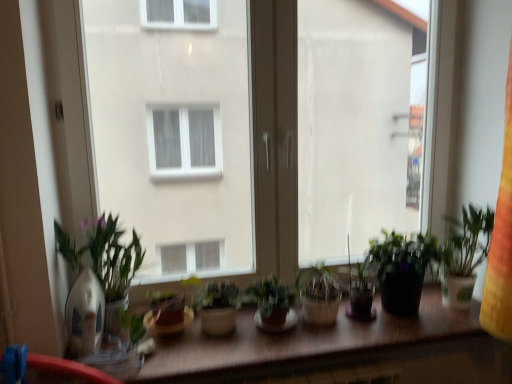
Question: Which direction should I rotate to face white matte window screen at center, arranged as the 2th window screen when viewed from the right, — up or down?

Choices:
 (A) up
 (B) down

Answer: (A)

Question: Considering the relative positions of green matte plant at center, positioned as the 2th houseplant in left-to-right order, and matte brown pot at center, which is the 1th houseplant from left to right, in the image provided, is green matte plant at center, positioned as the 2th houseplant in left-to-right order, to the left of matte brown pot at center, which is the 1th houseplant from left to right, from the viewer's perspective?

Choices:
 (A) no
 (B) yes

Answer: (A)

Question: Considering the relative sizes of green matte plant at center, positioned as the 2th houseplant in left-to-right order, and matte brown pot at center, which is the 1th houseplant from left to right, in the image provided, is green matte plant at center, positioned as the 2th houseplant in left-to-right order, wider than matte brown pot at center, which is the 1th houseplant from left to right,?

Choices:
 (A) no
 (B) yes

Answer: (A)

Question: Is green matte plant at center, which is counted as the third houseplant, starting from the right, oriented away from matte brown pot at center, which appears as the fourth houseplant when viewed from the right?

Choices:
 (A) yes
 (B) no

Answer: (B)

Question: Does green matte plant at center, which is counted as the third houseplant, starting from the right, turn towards matte brown pot at center, which appears as the fourth houseplant when viewed from the right?

Choices:
 (A) yes
 (B) no

Answer: (B)

Question: From the image's perspective, is green matte plant at center, positioned as the 2th houseplant in left-to-right order, over matte brown pot at center, which appears as the fourth houseplant when viewed from the right?

Choices:
 (A) no
 (B) yes

Answer: (B)

Question: Does green matte plant at center, positioned as the 2th houseplant in left-to-right order, lie in front of matte brown pot at center, which appears as the fourth houseplant when viewed from the right?

Choices:
 (A) no
 (B) yes

Answer: (A)

Question: Is matte brown pot at center, which is the 1th houseplant from left to right, wider than transparent plastic window screen at center, which is the 1th window screen in right-to-left order?

Choices:
 (A) yes
 (B) no

Answer: (A)

Question: Is matte brown pot at center, which is the 1th houseplant from left to right, shorter than transparent plastic window screen at center, acting as the 2th window screen starting from the left?

Choices:
 (A) no
 (B) yes

Answer: (B)

Question: Is matte brown pot at center, which appears as the fourth houseplant when viewed from the right, aimed at transparent plastic window screen at center, which is the 1th window screen in right-to-left order?

Choices:
 (A) yes
 (B) no

Answer: (B)

Question: Is matte brown pot at center, which appears as the fourth houseplant when viewed from the right, in contact with transparent plastic window screen at center, acting as the 2th window screen starting from the left?

Choices:
 (A) yes
 (B) no

Answer: (B)

Question: Is transparent plastic window screen at center, acting as the 2th window screen starting from the left, a part of matte brown pot at center, which appears as the fourth houseplant when viewed from the right?

Choices:
 (A) no
 (B) yes

Answer: (A)

Question: Considering the relative positions of matte brown pot at center, which appears as the fourth houseplant when viewed from the right, and transparent plastic window screen at center, which is the 1th window screen in right-to-left order, in the image provided, is matte brown pot at center, which appears as the fourth houseplant when viewed from the right, to the left of transparent plastic window screen at center, which is the 1th window screen in right-to-left order, from the viewer's perspective?

Choices:
 (A) no
 (B) yes

Answer: (B)

Question: Are wooden table at center and green matte plant at center, positioned as the 2th houseplant in left-to-right order, making contact?

Choices:
 (A) yes
 (B) no

Answer: (B)